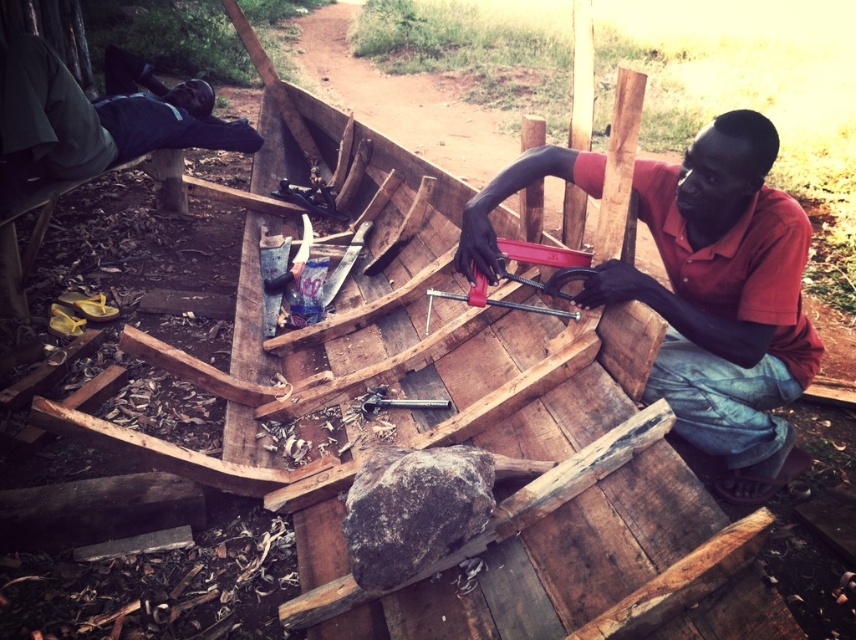
Is red matte wood at center below metallic red clamp at center?

Indeed, red matte wood at center is positioned under metallic red clamp at center.

Which is behind, point (693, 360) or point (586, 252)?

Positioned behind is point (586, 252).

Is point (740, 180) positioned before point (533, 284)?

Yes, point (740, 180) is closer to viewer.

Where is `red matte wood at center`? red matte wood at center is located at coordinates (724, 300).

Is green fabric shirt at upper left to the left of metallic red clamp at center from the viewer's perspective?

Correct, you'll find green fabric shirt at upper left to the left of metallic red clamp at center.

Is green fabric shirt at upper left smaller than metallic red clamp at center?

Incorrect, green fabric shirt at upper left is not smaller in size than metallic red clamp at center.

The image size is (856, 640). I want to click on green fabric shirt at upper left, so click(102, 113).

Between red matte wood at center and green fabric shirt at upper left, which one has less height?

Standing shorter between the two is green fabric shirt at upper left.

Who is more distant from viewer, (729, 472) or (135, 118)?

Point (135, 118)

Locate an element on the screen. red matte wood at center is located at coordinates (724, 300).